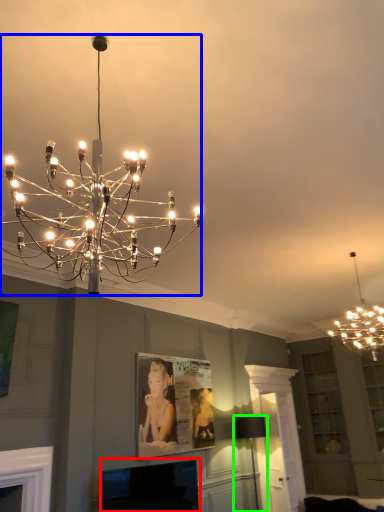
Question: Based on their relative distances, which object is farther from fireplace (highlighted by a red box)? Choose from lamp (highlighted by a blue box) and lamp (highlighted by a green box).

Choices:
 (A) lamp
 (B) lamp

Answer: (A)